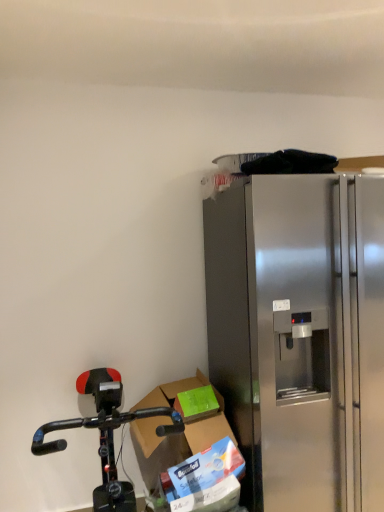
Question: Considering the positions of stainless steel refrigerator at right and black matte bicycle at lower left in the image, is stainless steel refrigerator at right taller or shorter than black matte bicycle at lower left?

Choices:
 (A) tall
 (B) short

Answer: (A)

Question: Is point (306, 481) positioned closer to the camera than point (104, 388)?

Choices:
 (A) closer
 (B) farther

Answer: (B)

Question: Which object is positioned closest to the cardboard box at lower center?

Choices:
 (A) black matte bicycle at lower left
 (B) stainless steel refrigerator at right

Answer: (A)

Question: Which object is the closest to the black matte bicycle at lower left?

Choices:
 (A) stainless steel refrigerator at right
 (B) cardboard box at lower center

Answer: (B)